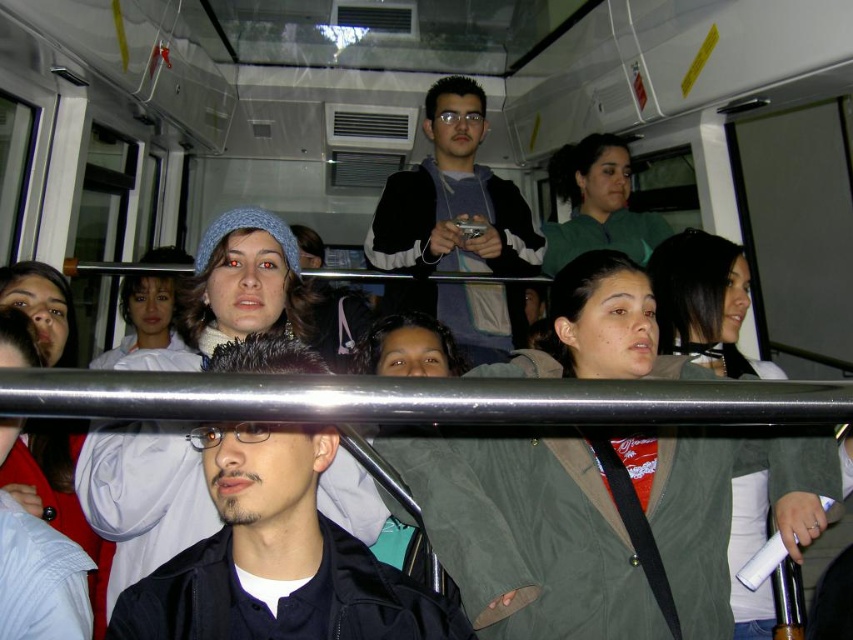
Describe the element at coordinates (453, 198) in the screenshot. I see `black sweater at center` at that location.

Does point (428, 186) come farther from viewer compared to point (572, 160)?

No, (428, 186) is closer to viewer.

This screenshot has width=853, height=640. Identify the location of black sweater at center. point(453,198).

Between dark blue jacket at center and green matte jacket at upper center, which one is positioned lower?

dark blue jacket at center

Is dark blue jacket at center below green matte jacket at upper center?

A: Correct, dark blue jacket at center is located below green matte jacket at upper center.

Is point (247, 484) more distant than point (590, 189)?

No, it is in front of (590, 189).

I want to click on dark blue jacket at center, so click(276, 557).

Is dark blue jacket at center below black sweater at center?

Correct, dark blue jacket at center is located below black sweater at center.

Who is positioned more to the left, dark blue jacket at center or black sweater at center?

dark blue jacket at center

Locate an element on the screen. The height and width of the screenshot is (640, 853). dark blue jacket at center is located at coordinates (276, 557).